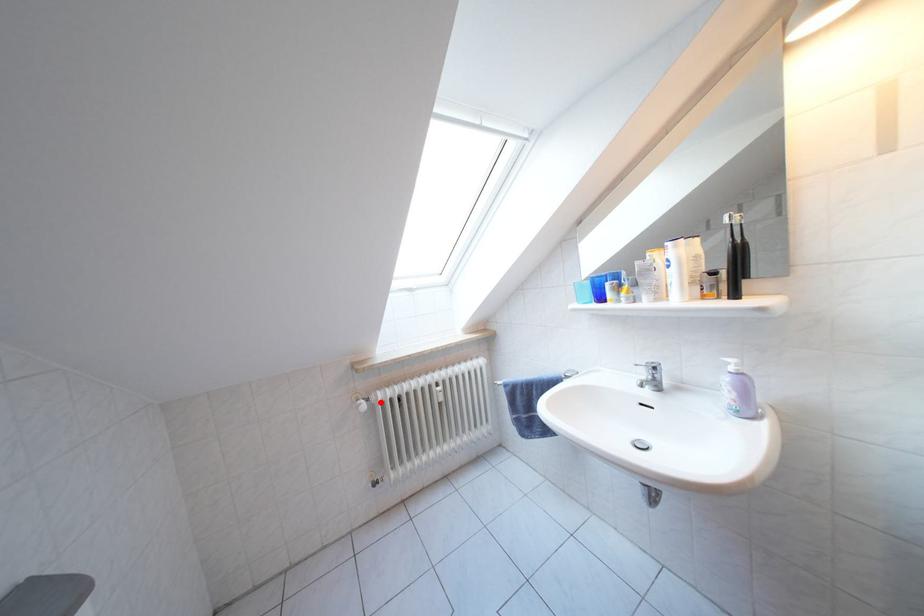
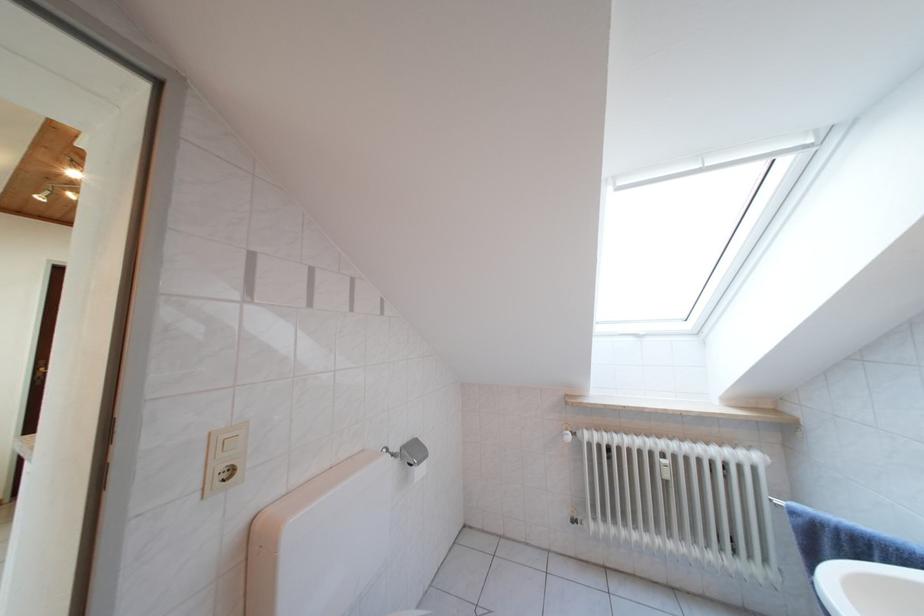
Where in the second image is the point corresponding to the highlighted location from the first image?

(588, 439)